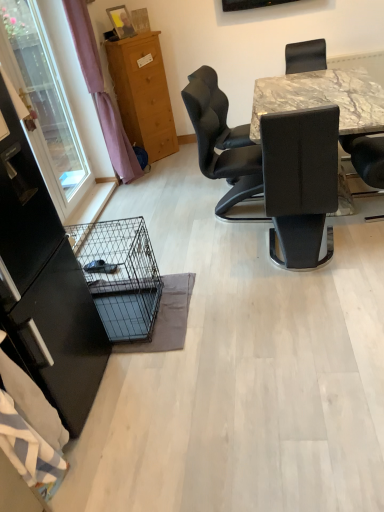
In order to face black wire mesh cage at lower left, should I rotate leftwards or rightwards?

To face it directly, rotate left by 12.015 degrees.

What is the approximate height of purple fabric curtain at left?

5.51 feet.

This screenshot has height=512, width=384. In order to click on black wire mesh cage at lower left in this screenshot , I will do `click(120, 275)`.

Is transparent plastic window screen at left placed right next to purple fabric curtain at left?

transparent plastic window screen at left and purple fabric curtain at left are clearly separated.

Looking at this image, does transparent plastic window screen at left have a larger size compared to purple fabric curtain at left?

No.

Is transparent plastic window screen at left positioned with its back to purple fabric curtain at left?

No, purple fabric curtain at left is not at the back of transparent plastic window screen at left.

Which object is closer to the camera, transparent plastic window screen at left or purple fabric curtain at left?

transparent plastic window screen at left is more forward.

Is transparent plastic window screen at left situated inside black wire mesh cage at lower left or outside?

transparent plastic window screen at left is located beyond the bounds of black wire mesh cage at lower left.

In the scene shown: Could you tell me if transparent plastic window screen at left is facing black wire mesh cage at lower left?

No, transparent plastic window screen at left is not aimed at black wire mesh cage at lower left.

Which is behind, transparent plastic window screen at left or black wire mesh cage at lower left?

transparent plastic window screen at left is further from the camera.

Which of these two, transparent plastic window screen at left or black wire mesh cage at lower left, is smaller?

With smaller size is black wire mesh cage at lower left.

From the image's perspective, is marble table at upper right located above or below wooden cabinet at upper left?

Clearly, from the image's perspective, marble table at upper right is below wooden cabinet at upper left.

Where is `desk in front of the wooden cabinet at upper left`? The width and height of the screenshot is (384, 512). desk in front of the wooden cabinet at upper left is located at coordinates (322, 98).

From a real-world perspective, is marble table at upper right below wooden cabinet at upper left?

Yes, from a real-world perspective, marble table at upper right is beneath wooden cabinet at upper left.

Would you consider marble table at upper right to be distant from wooden cabinet at upper left?

Yes, marble table at upper right and wooden cabinet at upper left are located far from each other.

Is transparent glass screen door at left to the right of wooden cabinet at upper left from the viewer's perspective?

Incorrect, transparent glass screen door at left is not on the right side of wooden cabinet at upper left.

From a real-world perspective, between transparent glass screen door at left and wooden cabinet at upper left, who is vertically lower?

wooden cabinet at upper left.

Image resolution: width=384 pixels, height=512 pixels. Find the location of `screen door that is in front of the wooden cabinet at upper left`. screen door that is in front of the wooden cabinet at upper left is located at coordinates (23, 204).

Is transparent glass screen door at left far away from wooden cabinet at upper left?

Absolutely, transparent glass screen door at left is distant from wooden cabinet at upper left.

Can you see marble table at upper right touching purple fabric curtain at left?

No, marble table at upper right is not in contact with purple fabric curtain at left.

Who is taller, marble table at upper right or purple fabric curtain at left?

purple fabric curtain at left is taller.

From a real-world perspective, is marble table at upper right over purple fabric curtain at left?

No, from a real-world perspective, marble table at upper right is not over purple fabric curtain at left

Between marble table at upper right and purple fabric curtain at left, which one has larger width?

With larger width is marble table at upper right.

Can you confirm if black leather chair at center is smaller than transparent glass screen door at left?

No, black leather chair at center is not smaller than transparent glass screen door at left.

The height and width of the screenshot is (512, 384). Identify the location of chair behind the transparent glass screen door at left. (221, 143).

Considering the relative sizes of black leather chair at center and transparent glass screen door at left in the image provided, is black leather chair at center shorter than transparent glass screen door at left?

In fact, black leather chair at center may be taller than transparent glass screen door at left.

How much distance is there between black leather chair at center and transparent glass screen door at left?

They are 1.62 meters apart.

Is transparent glass screen door at left facing towards transparent plastic window screen at left?

No.

Considering the positions of objects transparent glass screen door at left and transparent plastic window screen at left in the image provided, who is in front, transparent glass screen door at left or transparent plastic window screen at left?

transparent glass screen door at left is in front.

Who is smaller, transparent glass screen door at left or transparent plastic window screen at left?

transparent glass screen door at left.

From a real-world perspective, who is located higher, transparent glass screen door at left or transparent plastic window screen at left?

transparent glass screen door at left, from a real-world perspective.

At what (x,y) coordinates should I click in order to perform the action: click on curtain that is under the transparent plastic window screen at left (from a real-world perspective). Please return your answer as a coordinate pair (x, y). Looking at the image, I should click on (101, 92).

Image resolution: width=384 pixels, height=512 pixels. Find the location of `window screen above the black wire mesh cage at lower left (from the image's perspective)`. window screen above the black wire mesh cage at lower left (from the image's perspective) is located at coordinates (44, 102).

When comparing their distances from wooden cabinet at upper left, does black wire mesh cage at lower left or transparent plastic window screen at left seem closer?

The object closer to wooden cabinet at upper left is transparent plastic window screen at left.

Looking at the image, which one is located further to black leather chair at center, transparent glass screen door at left or transparent plastic window screen at left?

transparent glass screen door at left lies further to black leather chair at center than the other object.

Based on their spatial positions, is wooden cabinet at upper left or black leather chair at center further from marble table at upper right?

wooden cabinet at upper left lies further to marble table at upper right than the other object.

Which object lies nearer to the anchor point transparent plastic window screen at left, black leather chair at center or purple fabric curtain at left?

purple fabric curtain at left.

Considering their positions, is black leather chair at center positioned further to black wire mesh cage at lower left than transparent plastic window screen at left?

black leather chair at center lies further to black wire mesh cage at lower left than the other object.

From the image, which object appears to be farther from transparent plastic window screen at left, wooden cabinet at upper left or black leather chair at center?

black leather chair at center is positioned further to the anchor transparent plastic window screen at left.

Considering their positions, is transparent glass screen door at left positioned further to wooden cabinet at upper left than black leather chair at center?

The object further to wooden cabinet at upper left is transparent glass screen door at left.

Estimate the real-world distances between objects in this image. Which object is further from wooden cabinet at upper left, black wire mesh cage at lower left or purple fabric curtain at left?

black wire mesh cage at lower left is positioned further to the anchor wooden cabinet at upper left.

At what (x,y) coordinates should I click in order to perform the action: click on curtain positioned between transparent glass screen door at left and wooden cabinet at upper left from near to far. Please return your answer as a coordinate pair (x, y). This screenshot has width=384, height=512. Looking at the image, I should click on (101, 92).

The height and width of the screenshot is (512, 384). In order to click on chair between transparent glass screen door at left and purple fabric curtain at left from front to back in this screenshot , I will do `click(221, 143)`.

The height and width of the screenshot is (512, 384). Find the location of `chair between transparent glass screen door at left and wooden cabinet at upper left along the z-axis`. chair between transparent glass screen door at left and wooden cabinet at upper left along the z-axis is located at coordinates (221, 143).

Locate an element on the screen. This screenshot has width=384, height=512. curtain between black wire mesh cage at lower left and wooden cabinet at upper left along the z-axis is located at coordinates pos(101,92).